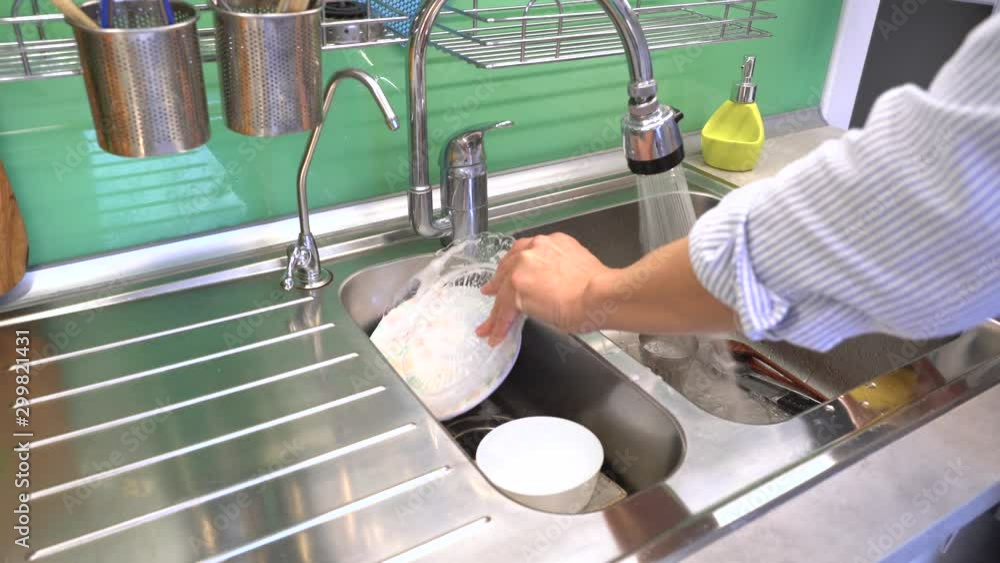
This screenshot has height=563, width=1000. Identify the location of faucet. (656, 133).